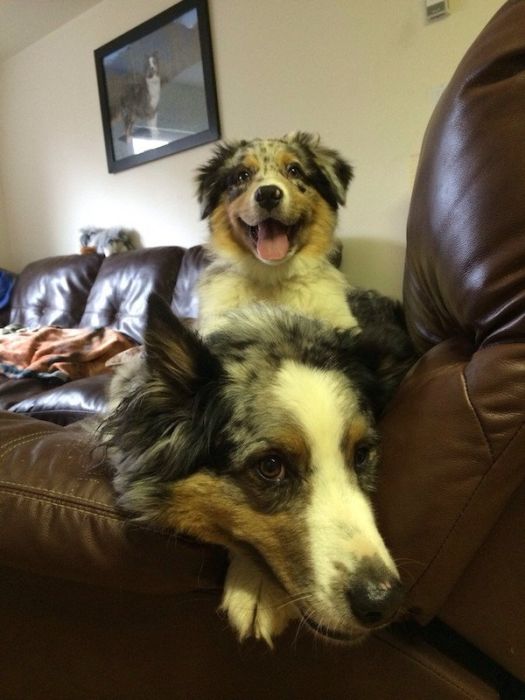
You are a GUI agent. You are given a task and a screenshot of the screen. Output one action in this format:
    pyautogui.click(x=<x>, y=<y>)
    Task: Click on the armchair
    This screenshot has height=700, width=525.
    Given the screenshot: What is the action you would take?
    pyautogui.click(x=60, y=477)